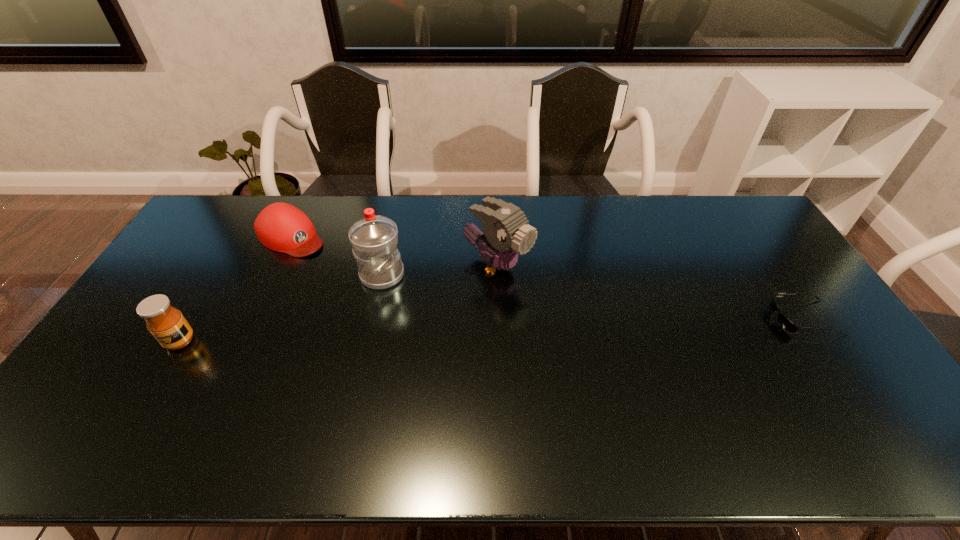
The height and width of the screenshot is (540, 960). Find the location of `empty location between the fourth object from right to left and the water bottle`. empty location between the fourth object from right to left and the water bottle is located at coordinates (337, 255).

At what (x,y) coordinates should I click in order to perform the action: click on free space between the third object from left to right and the third shortest object. Please return your answer as a coordinate pair (x, y). The height and width of the screenshot is (540, 960). Looking at the image, I should click on (281, 308).

Identify the location of vacant point located between the honey and the fourth object from right to left. (236, 289).

Where is `vacant area between the fourth object from right to left and the water bottle`? vacant area between the fourth object from right to left and the water bottle is located at coordinates (337, 255).

This screenshot has height=540, width=960. Identify the location of free spot between the third object from right to left and the fourth object from right to left. (337, 255).

Where is `vacant space in between the third shortest object and the fourth tallest object`? This screenshot has height=540, width=960. vacant space in between the third shortest object and the fourth tallest object is located at coordinates (236, 289).

This screenshot has height=540, width=960. Identify the location of blank region between the shortest object and the third shortest object. pos(492,329).

Where is `free space between the fourth object from left to right and the sunglasses`? This screenshot has width=960, height=540. free space between the fourth object from left to right and the sunglasses is located at coordinates (650, 292).

The image size is (960, 540). I want to click on object identified as the closest to the baseball cap, so click(374, 238).

Point out which object is positioned as the fourth nearest to the second object from right to left. Please provide its 2D coordinates. Your answer should be formatted as a tuple, i.e. [(x, y)], where the tuple contains the x and y coordinates of a point satisfying the conditions above.

[(166, 323)]